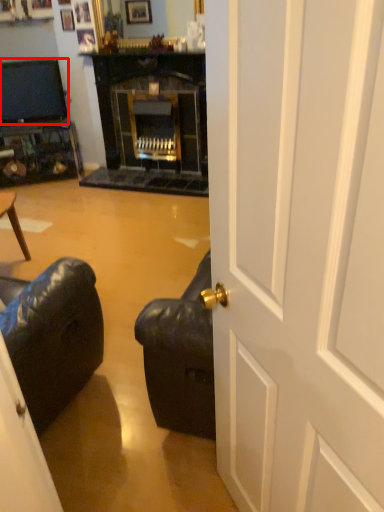
Question: Considering the relative positions of television (annotated by the red box) and door in the image provided, where is television (annotated by the red box) located with respect to the staircase?

Choices:
 (A) right
 (B) left

Answer: (B)